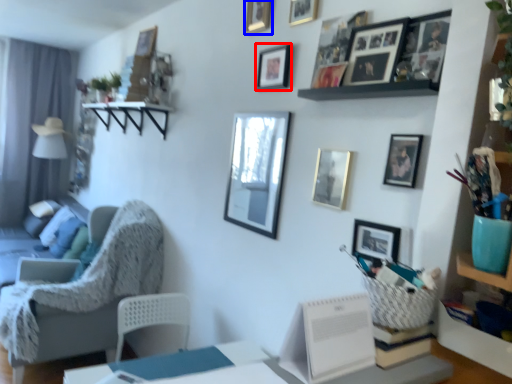
Question: Which point is closer to the camera, picture frame (highlighted by a red box) or picture frame (highlighted by a blue box)?

Choices:
 (A) picture frame
 (B) picture frame

Answer: (A)